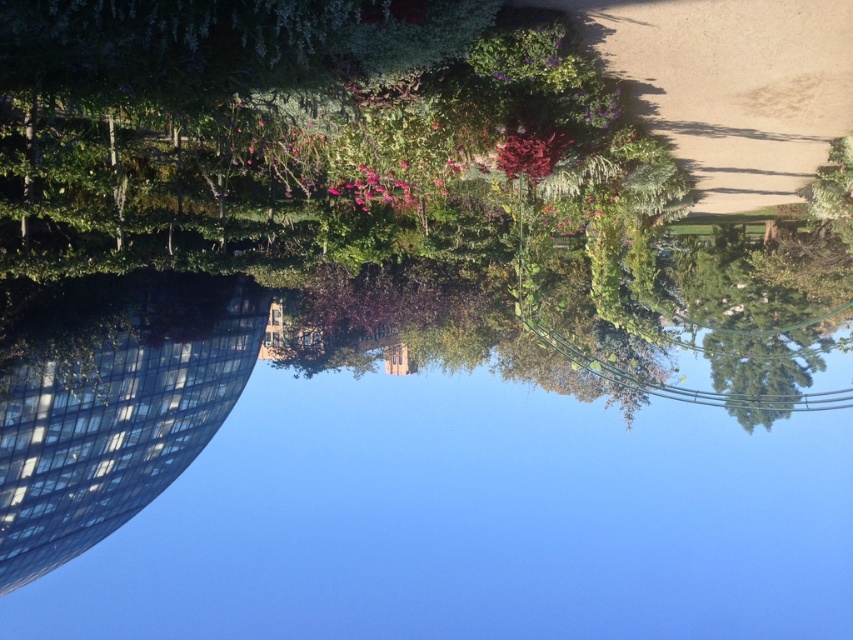
You are standing in the garden and want to walk towards the transparent glass water at center and the green leafy tree at center. Which object will you encounter first?

You will encounter the transparent glass water at center first because it is closer to you than the green leafy tree at center, which is further away.

You are standing in the garden scene and want to find the transparent glass water at center. Based on the coordinates provided, which direction should you look to locate it?

The transparent glass water at center is located at coordinates point (431, 451), so you should look towards the center of the image slightly to the right.